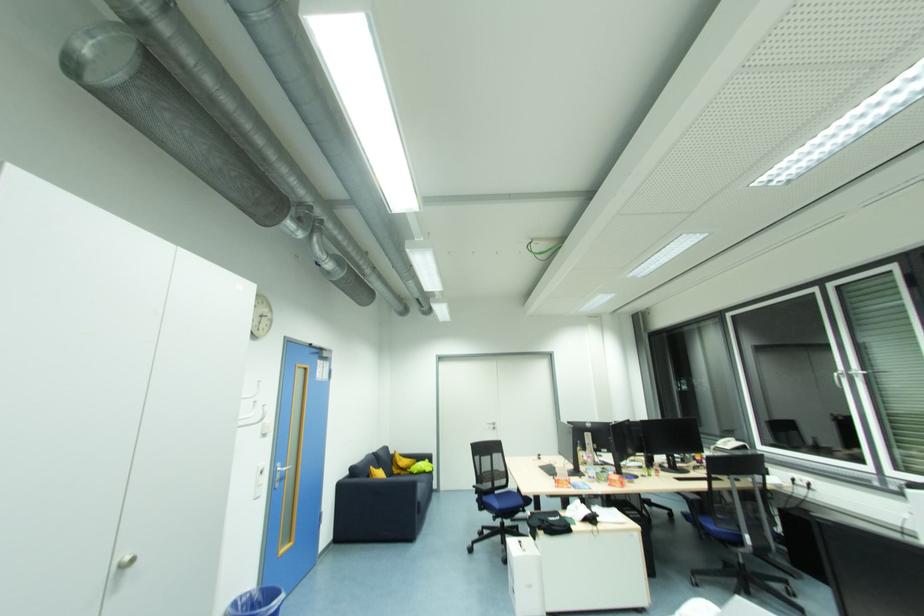
You are a GUI agent. You are given a task and a screenshot of the screen. Output one action in this format:
    pyautogui.click(x=<x>, y=<y>)
    Task: Click on the blue trash can
    
    Given the screenshot: What is the action you would take?
    tap(257, 602)